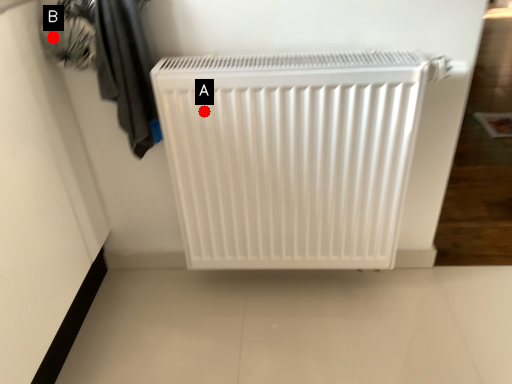
Question: Two points are circled on the image, labeled by A and B beside each circle. Which point appears farthest from the camera in this image?

Choices:
 (A) A is further
 (B) B is further

Answer: (A)